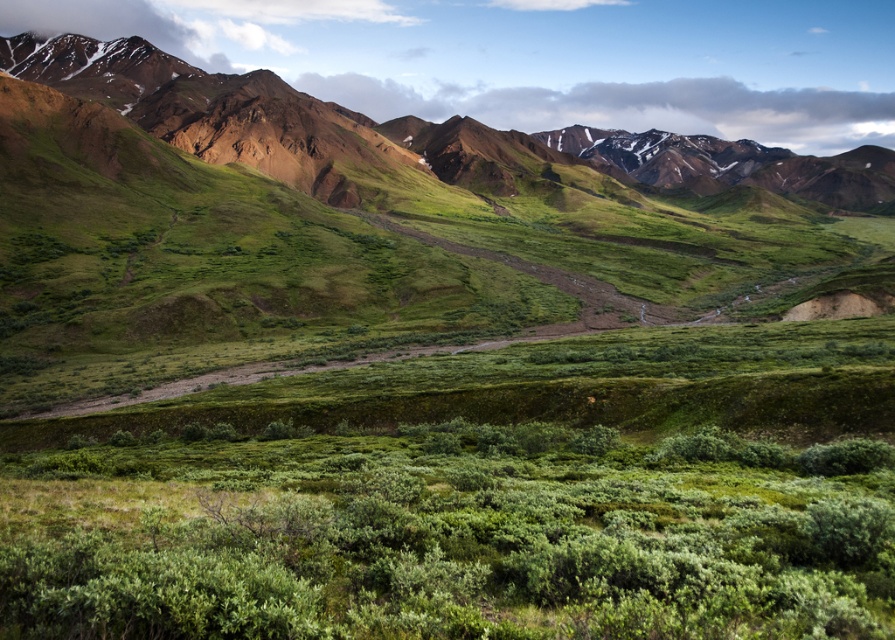
Between point (24, 506) and point (271, 83), which one is positioned behind?

Point (271, 83)

Is point (118, 552) behind point (697, 157)?

No, (118, 552) is in front of (697, 157).

Where is `green leafy shrubs at center`? green leafy shrubs at center is located at coordinates (452, 538).